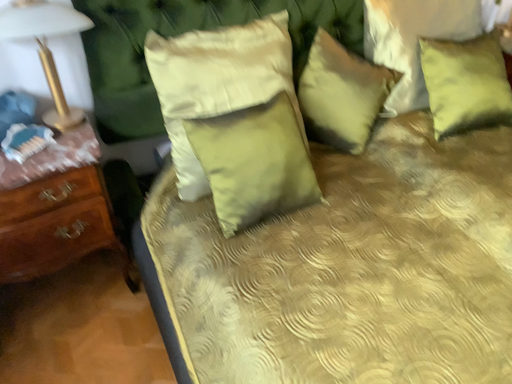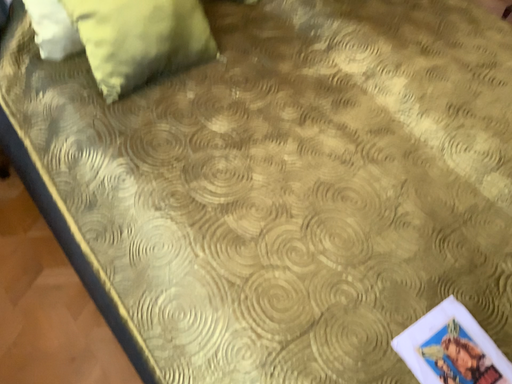
Question: How did the camera likely rotate when shooting the video?

Choices:
 (A) rotated left
 (B) rotated right

Answer: (B)